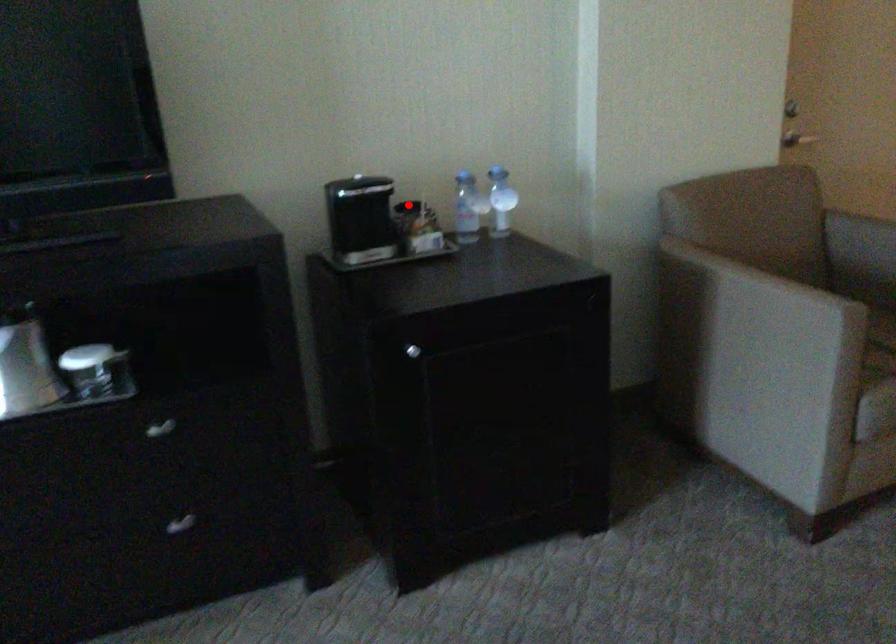
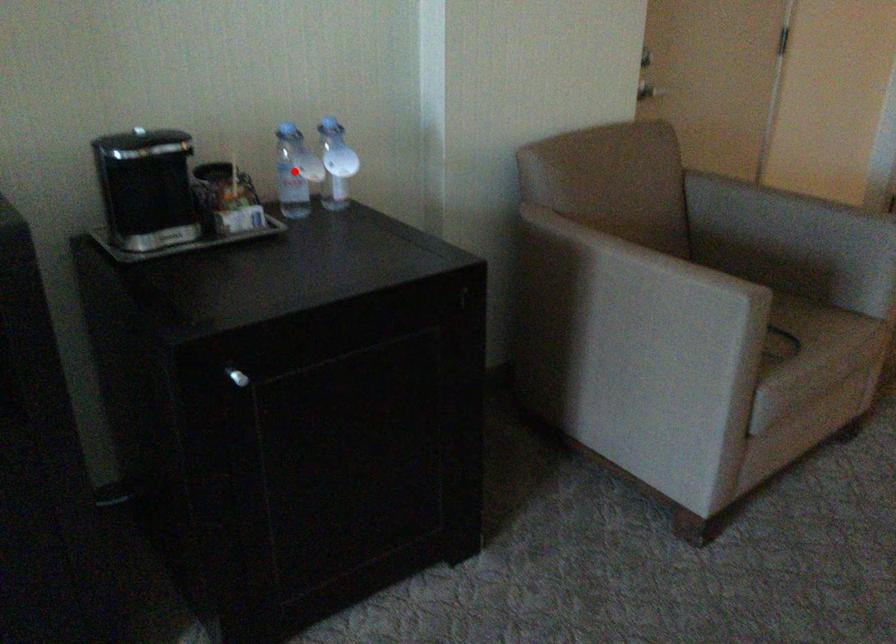
Based on the photo, I am providing you with two images of the same scene from different viewpoints. A red point is marked on the first image and another point is marked on the second image. Is the red point in image1 aligned with the point shown in image2?

No